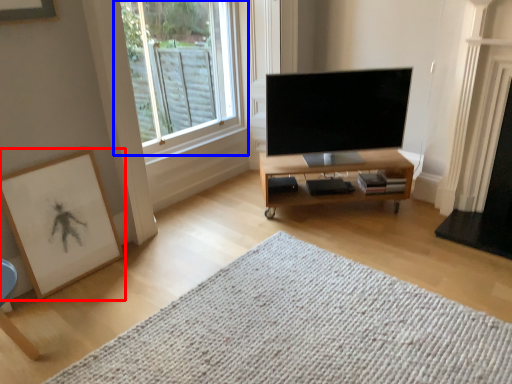
Question: Which of the following is the farthest to the observer, picture frame (highlighted by a red box) or window (highlighted by a blue box)?

Choices:
 (A) picture frame
 (B) window

Answer: (B)